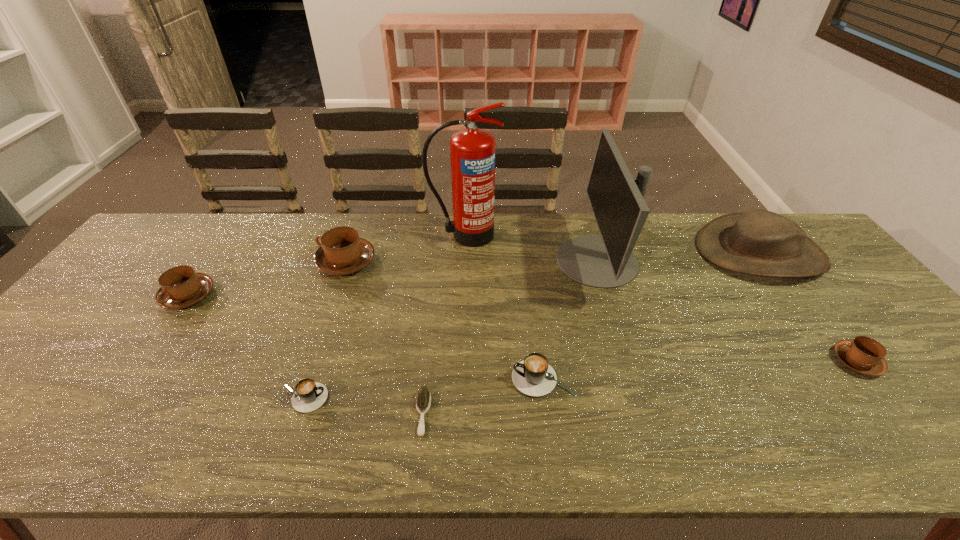
Find the location of a particular element. vacant region located 0.300m on the screen of the seventh object from left to right is located at coordinates (459, 261).

Find the location of a particular element. vacant region located 0.330m on the front of the seventh shortest object is located at coordinates (860, 386).

This screenshot has height=540, width=960. I want to click on free space located on the side of the fourth tallest object with the handle, so click(x=205, y=261).

Locate an element on the screen. Image resolution: width=960 pixels, height=540 pixels. vacant region located on the side of the fourth tallest object with the handle is located at coordinates (205, 261).

This screenshot has height=540, width=960. In order to click on vacant point located 0.110m on the side of the fourth tallest object with the handle in this screenshot , I will do `click(280, 261)`.

The image size is (960, 540). Identify the location of vacant space located on the side of the second smallest brown cappuccino with the handle. (150, 349).

The width and height of the screenshot is (960, 540). In order to click on free space located 0.320m with the handle on the side of the fourth object from right to left in this screenshot , I will do `click(375, 379)`.

I want to click on vacant position located 0.110m with the handle on the side of the fourth object from right to left, so click(465, 379).

Where is `free space located 0.360m with the handle on the side of the fourth object from right to left`? free space located 0.360m with the handle on the side of the fourth object from right to left is located at coordinates (358, 379).

The width and height of the screenshot is (960, 540). Identify the location of free space located 0.110m on the side of the nearest brown cappuccino with the handle. (789, 361).